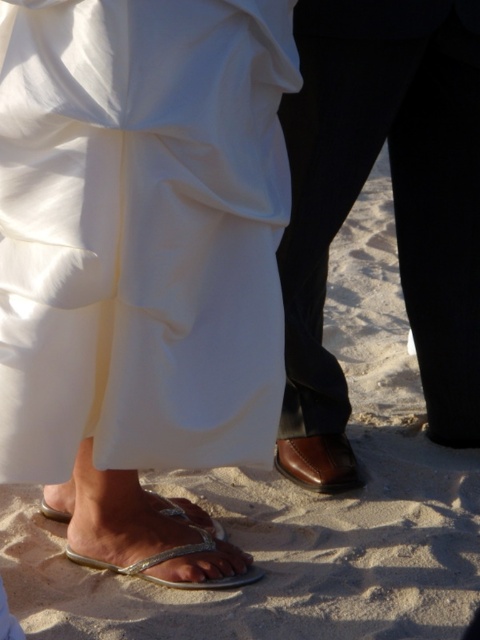
Question: Is brown leather shoes at lower center smaller than brown leather shoe at center?

Choices:
 (A) no
 (B) yes

Answer: (A)

Question: Estimate the real-world distances between objects in this image. Which object is closer to the white leather sandal at lower left?

Choices:
 (A) silver metallic flip-flop at lower left
 (B) brown leather shoes at lower center
 (C) white satin dress at center
 (D) brown leather shoe at center

Answer: (A)

Question: Which object is the closest to the brown leather shoe at center?

Choices:
 (A) silver metallic flip-flop at lower left
 (B) white satin dress at center

Answer: (A)

Question: Is the position of white satin dress at center more distant than that of silver metallic flip-flop at lower left?

Choices:
 (A) no
 (B) yes

Answer: (A)

Question: Considering the real-world distances, which object is closest to the white satin dress at center?

Choices:
 (A) brown leather shoe at center
 (B) white leather sandal at lower left
 (C) silver metallic flip-flop at lower left
 (D) brown leather shoes at lower center

Answer: (D)

Question: Does white satin dress at center appear under white leather sandal at lower left?

Choices:
 (A) yes
 (B) no

Answer: (B)